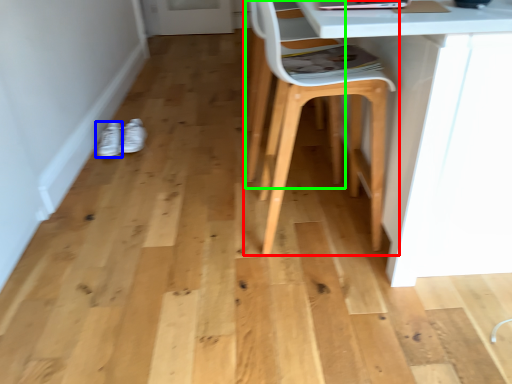
Question: Which object is positioned farthest from chair (highlighted by a red box)? Select from footwear (highlighted by a blue box) and swivel chair (highlighted by a green box).

Choices:
 (A) footwear
 (B) swivel chair

Answer: (A)